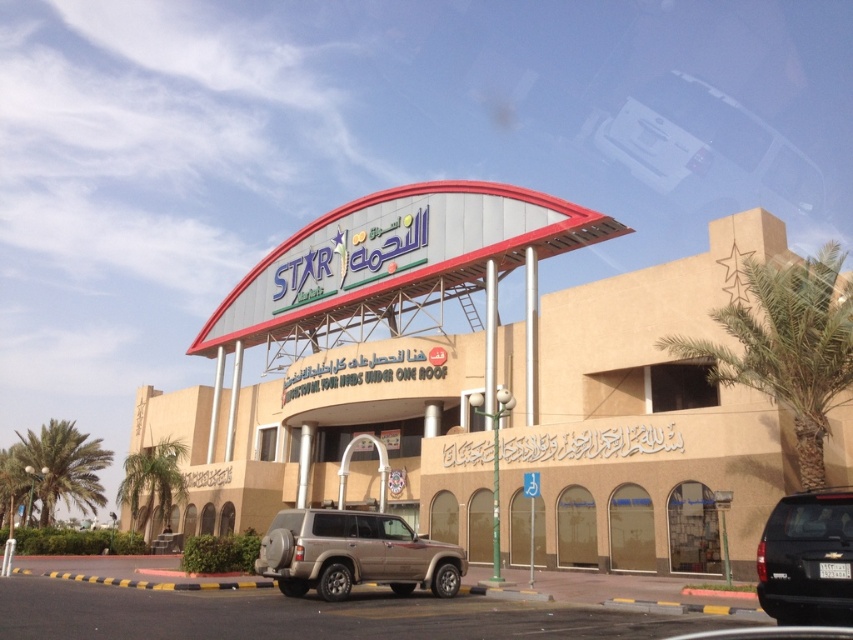
Does beige concrete building at center come in front of white glossy car at upper center?

Yes.

Does beige concrete building at center appear under white glossy car at upper center?

Correct, beige concrete building at center is located below white glossy car at upper center.

Who is more distant from viewer, (421,225) or (790,204)?

The point (790,204) is more distant.

Where is `beige concrete building at center`? This screenshot has height=640, width=853. beige concrete building at center is located at coordinates (483, 380).

Can you confirm if beige concrete building at center is smaller than green leafy palm tree at right?

Yes.

Does point (335, 296) lie behind point (808, 348)?

Yes, point (335, 296) is behind point (808, 348).

The image size is (853, 640). I want to click on beige concrete building at center, so click(483, 380).

Does beige concrete building at center have a lesser width compared to black matte suv at lower right?

No.

Which is in front, point (463, 355) or point (776, 579)?

Positioned in front is point (776, 579).

I want to click on beige concrete building at center, so click(x=483, y=380).